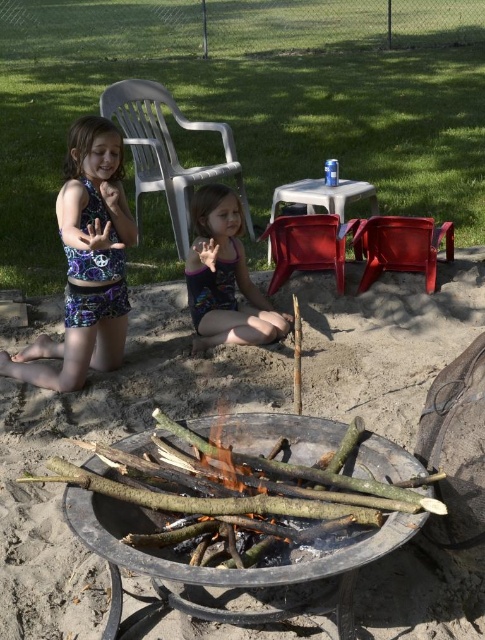
Question: Does purple swimsuit at center appear under red plastic chair at center?

Choices:
 (A) no
 (B) yes

Answer: (B)

Question: Which point is farther to the camera?

Choices:
 (A) (108, 419)
 (B) (204, 346)

Answer: (B)

Question: Does purple swimsuit at center come behind matte plastic chair at center?

Choices:
 (A) no
 (B) yes

Answer: (A)

Question: Observing the image, what is the correct spatial positioning of purple swimsuit at center in reference to plastic chair at upper left?

Choices:
 (A) right
 (B) left

Answer: (A)

Question: Based on their relative distances, which object is farther from the plastic chair at upper left?

Choices:
 (A) purple swimsuit at center
 (B) matte plastic chair at center
 (C) printed fabric swimsuit at left
 (D) brown sandy ground at center

Answer: (C)

Question: Which of the following is the closest to the observer?

Choices:
 (A) (462, 630)
 (B) (404, 246)

Answer: (A)